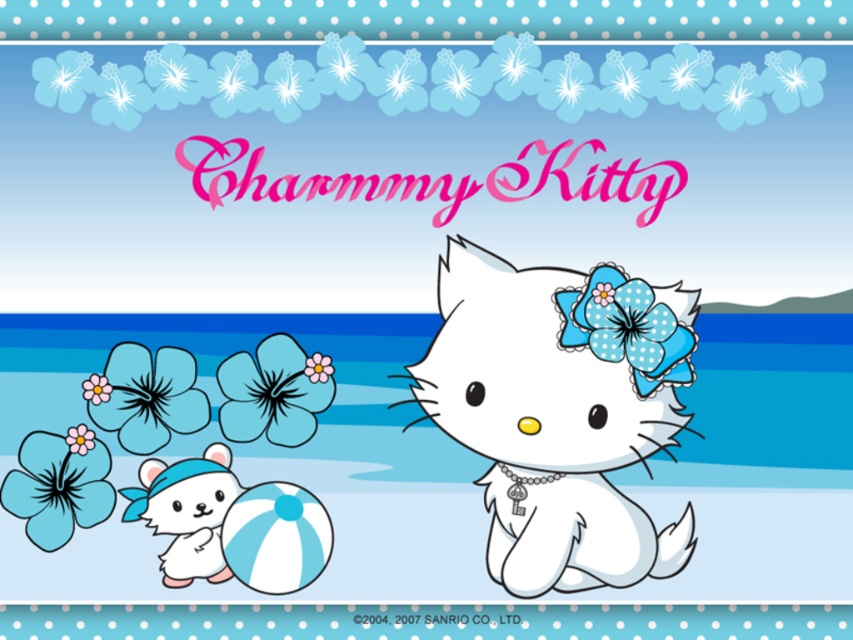
Question: Is white matte cat at center to the right of pink paper flower at lower left from the viewer's perspective?

Choices:
 (A) no
 (B) yes

Answer: (B)

Question: In this image, where is white plush bear at lower left located relative to pink paper flower at lower left?

Choices:
 (A) above
 (B) below

Answer: (B)

Question: Which object is farther from the camera taking this photo?

Choices:
 (A) white plush bear at lower left
 (B) pink paper flower at lower left
 (C) blue striped beach ball at lower left

Answer: (C)

Question: Based on their relative distances, which object is nearer to the pink paper flower at lower left?

Choices:
 (A) blue striped beach ball at lower left
 (B) white plush bear at lower left
 (C) matte blue flower at upper left
 (D) pink fabric flower at center

Answer: (C)

Question: Which of these objects is positioned farthest from the pink fabric flower at center?

Choices:
 (A) pink paper flower at lower left
 (B) white matte cat at center
 (C) white plush bear at lower left
 (D) matte blue flower at upper left

Answer: (B)

Question: Can you confirm if matte blue flower at upper left is positioned above pink fabric flower at center?

Choices:
 (A) no
 (B) yes

Answer: (A)